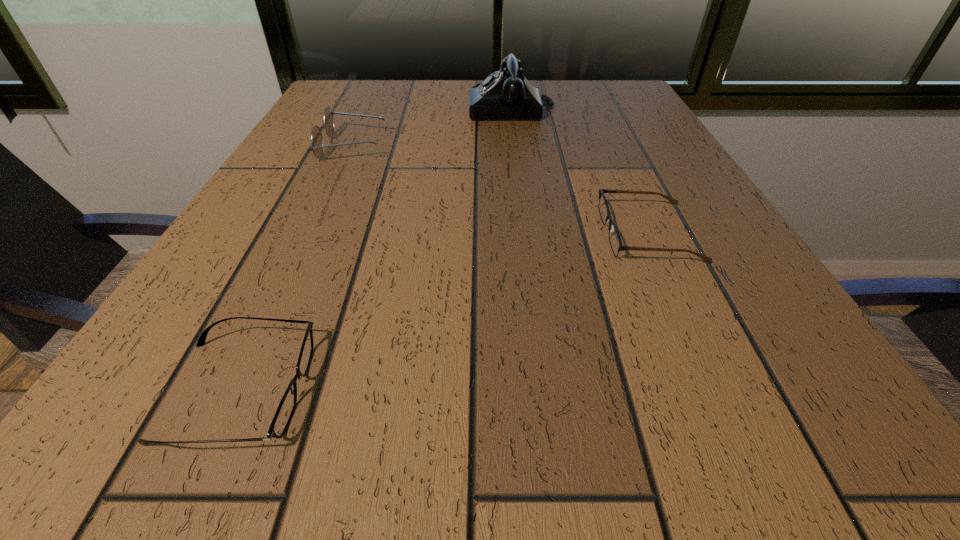
Where is `telephone`? This screenshot has height=540, width=960. telephone is located at coordinates (507, 94).

Find the location of a particular element. the tallest object is located at coordinates (507, 94).

Identify the location of the farthest spectacles. (316, 146).

The height and width of the screenshot is (540, 960). Find the location of `the tallest spectacles`. the tallest spectacles is located at coordinates (316, 146).

Locate an element on the screen. the nearest spectacles is located at coordinates (281, 420).

Image resolution: width=960 pixels, height=540 pixels. What are the coordinates of `the second nearest object` in the screenshot? It's located at (615, 241).

The width and height of the screenshot is (960, 540). Find the location of `the rightmost spectacles`. the rightmost spectacles is located at coordinates (615, 241).

You are a GUI agent. You are given a task and a screenshot of the screen. Output one action in this format:
    pyautogui.click(x=<x>, y=<y>)
    Task: Click on the blank area located 0.230m on the dial of the second object from right to left
    
    Given the screenshot: What is the action you would take?
    pyautogui.click(x=371, y=107)

The width and height of the screenshot is (960, 540). I want to click on free space located 0.360m on the dial of the second object from right to left, so click(315, 107).

Where is `free space located 0.360m on the dial of the second object from right to left`? Image resolution: width=960 pixels, height=540 pixels. free space located 0.360m on the dial of the second object from right to left is located at coordinates (315, 107).